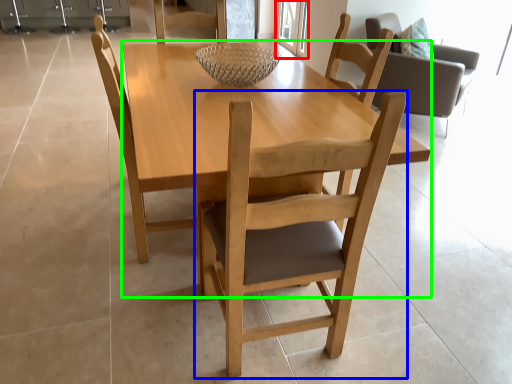
Question: Estimate the real-world distances between objects in this image. Which object is closer to glass door (highlighted by a red box), chair (highlighted by a blue box) or round table (highlighted by a green box)?

Choices:
 (A) chair
 (B) round table

Answer: (B)